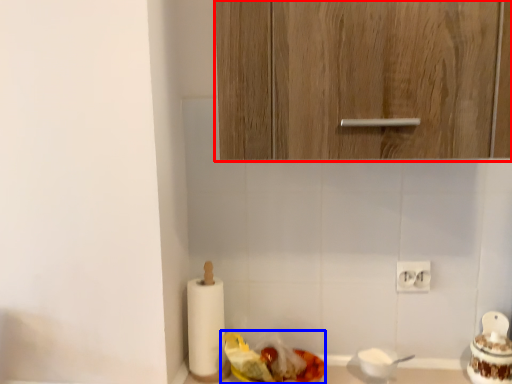
Question: Which of the following is the closest to the observer, cabinetry (highlighted by a red box) or food (highlighted by a blue box)?

Choices:
 (A) cabinetry
 (B) food

Answer: (A)